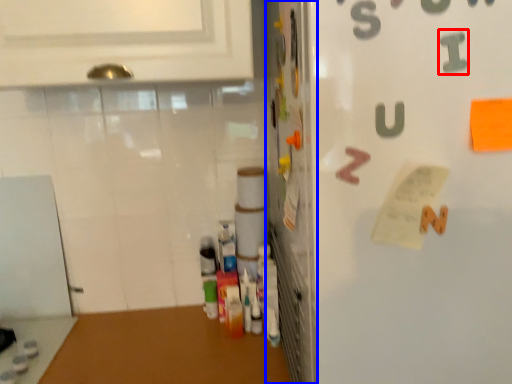
Question: Which of the following is the closest to the observer, alphabet (highlighted by a red box) or door (highlighted by a blue box)?

Choices:
 (A) alphabet
 (B) door

Answer: (A)